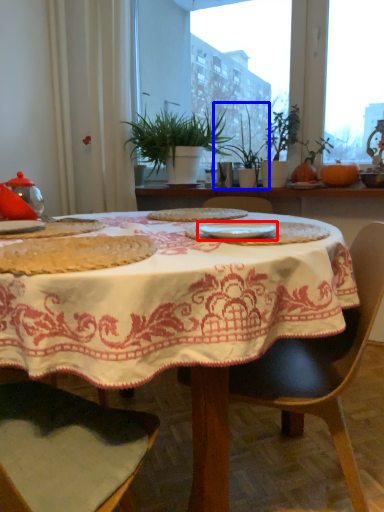
Question: Which point is further to the camera, tableware (highlighted by a red box) or houseplant (highlighted by a blue box)?

Choices:
 (A) tableware
 (B) houseplant

Answer: (B)